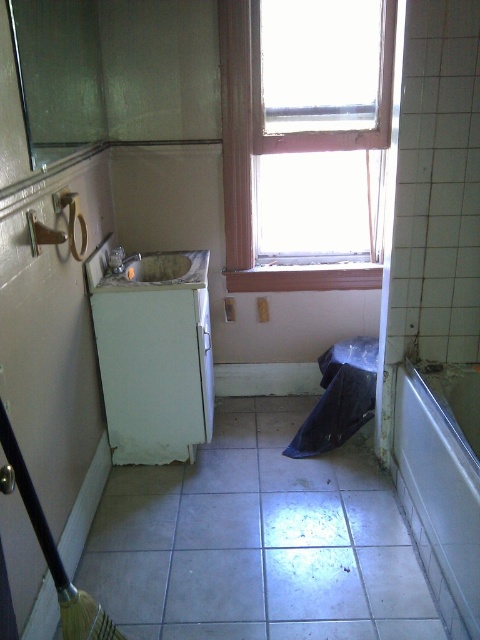
You are standing in the bathroom and need to determine if the white glossy bathtub at lower right can be seen from the transparent glass window at upper center. Based on their heights, can the bathtub be seen through the window?

The white glossy bathtub at lower right is not as tall as the transparent glass window at upper center, so the bathtub can be seen through the window because it is shorter and within the window view.

You are standing in the bathroom and want to wash your hands. Which object should you approach first, the white glossy bathtub at lower right or the white glossy sink at center?

You should approach the white glossy sink at center first because it is closer to you than the white glossy bathtub at lower right, which is further away.